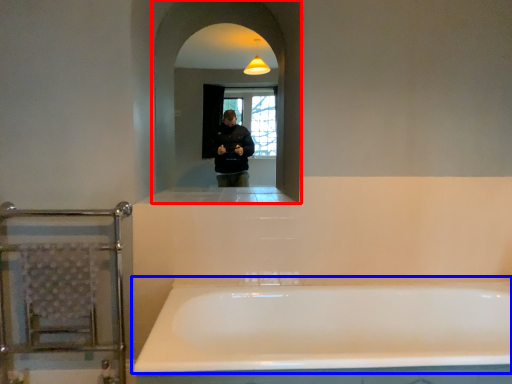
Question: Which object appears closest to the camera in this image, mirror (highlighted by a red box) or bathtub (highlighted by a blue box)?

Choices:
 (A) mirror
 (B) bathtub

Answer: (B)